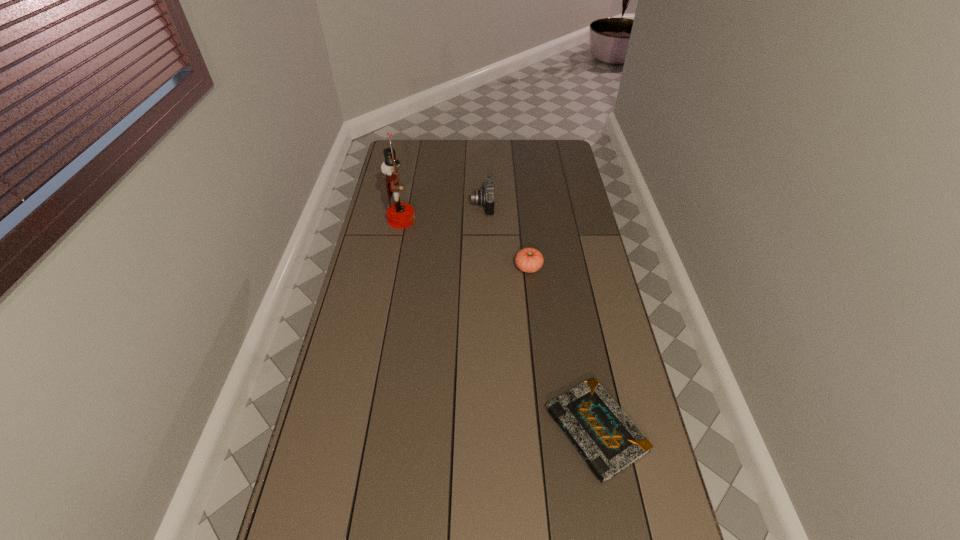
This screenshot has width=960, height=540. I want to click on the leftmost object, so click(x=400, y=215).

Where is `the tallest object`? The height and width of the screenshot is (540, 960). the tallest object is located at coordinates (400, 215).

The width and height of the screenshot is (960, 540). I want to click on camera, so click(485, 197).

Find the location of a particular element. the third object from right to left is located at coordinates (485, 197).

Where is `the second shortest object`? Image resolution: width=960 pixels, height=540 pixels. the second shortest object is located at coordinates (529, 260).

Locate an element on the screen. Image resolution: width=960 pixels, height=540 pixels. the third farthest object is located at coordinates (529, 260).

This screenshot has height=540, width=960. I want to click on the nearest object, so click(607, 439).

Identify the location of the shortest object. The height and width of the screenshot is (540, 960). (607, 439).

Find the location of a particular element. free point located on the front-facing side of the tallest object is located at coordinates (451, 220).

Find the location of `free space located on the front-facing side of the second tallest object`. free space located on the front-facing side of the second tallest object is located at coordinates (421, 205).